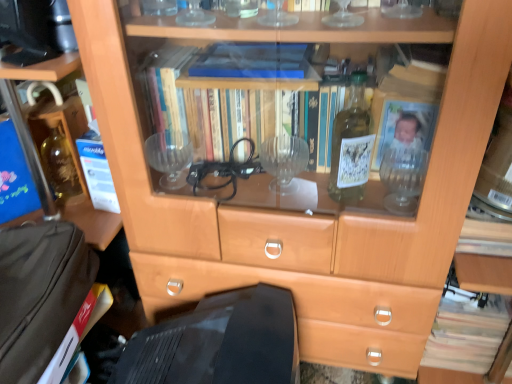
What do you see at coordinates (467, 332) in the screenshot? I see `light brown paper book at lower right` at bounding box center [467, 332].

What do you see at coordinates (219, 343) in the screenshot?
I see `black glossy computer monitor at lower center` at bounding box center [219, 343].

Locate an element on the screen. Image resolution: width=512 pixels, height=384 pixels. brown fabric suitcase at lower left is located at coordinates (40, 294).

Is white paper at left, which is the 1th paperback book in top-to-bottom order, oriented towards brown paper at left, placed as the first paperback book when sorted from bottom to top?

No, white paper at left, which is the 1th paperback book in top-to-bottom order, is not facing towards brown paper at left, placed as the first paperback book when sorted from bottom to top.

Considering the sizes of objects white paper at left, which is the 1th paperback book in top-to-bottom order, and brown paper at left, placed as the first paperback book when sorted from bottom to top, in the image provided, who is shorter, white paper at left, which is the 1th paperback book in top-to-bottom order, or brown paper at left, placed as the first paperback book when sorted from bottom to top,?

With less height is brown paper at left, placed as the first paperback book when sorted from bottom to top.

In the image, is white paper at left, which ranks as the second paperback book in bottom-to-top order, on the left side or the right side of brown paper at left, which is the second paperback book in top-to-bottom order?

Clearly, white paper at left, which ranks as the second paperback book in bottom-to-top order, is on the right of brown paper at left, which is the second paperback book in top-to-bottom order, in the image.

Is white paper at left, which ranks as the second paperback book in bottom-to-top order, bigger than brown paper at left, placed as the first paperback book when sorted from bottom to top?

Actually, white paper at left, which ranks as the second paperback book in bottom-to-top order, might be smaller than brown paper at left, placed as the first paperback book when sorted from bottom to top.

Does light brown paper book at lower right have a lesser width compared to white paper at left, which is the 1th paperback book in top-to-bottom order?

No.

From the picture: Does light brown paper book at lower right turn towards white paper at left, which is the 1th paperback book in top-to-bottom order?

No, light brown paper book at lower right does not turn towards white paper at left, which is the 1th paperback book in top-to-bottom order.

Considering the positions of points (487, 331) and (105, 185), is point (487, 331) farther from camera compared to point (105, 185)?

Yes, it is.

Which is more to the right, light brown paper book at lower right or white paper at left, which ranks as the second paperback book in bottom-to-top order?

Positioned to the right is light brown paper book at lower right.

In terms of height, does black glossy computer monitor at lower center look taller or shorter compared to brown fabric suitcase at lower left?

In the image, black glossy computer monitor at lower center appears to be taller than brown fabric suitcase at lower left.

Would you consider black glossy computer monitor at lower center to be distant from brown fabric suitcase at lower left?

No.

Who is smaller, black glossy computer monitor at lower center or brown fabric suitcase at lower left?

brown fabric suitcase at lower left is smaller.

Can you confirm if black glossy computer monitor at lower center is wider than brown fabric suitcase at lower left?

Indeed, black glossy computer monitor at lower center has a greater width compared to brown fabric suitcase at lower left.

Based on the photo, which of these two, brown fabric suitcase at lower left or light brown paper book at lower right, stands shorter?

brown fabric suitcase at lower left is shorter.

I want to click on book that appears behind the brown fabric suitcase at lower left, so click(x=467, y=332).

Considering the positions of objects brown fabric suitcase at lower left and light brown paper book at lower right in the image provided, who is more to the left, brown fabric suitcase at lower left or light brown paper book at lower right?

Positioned to the left is brown fabric suitcase at lower left.

Is brown paper at left, placed as the first paperback book when sorted from bottom to top, positioned behind brown fabric suitcase at lower left?

Yes, brown paper at left, placed as the first paperback book when sorted from bottom to top, is further from the viewer.

Visually, is brown paper at left, which is the second paperback book in top-to-bottom order, positioned to the left or to the right of brown fabric suitcase at lower left?

In the image, brown paper at left, which is the second paperback book in top-to-bottom order, appears on the right side of brown fabric suitcase at lower left.

Locate an element on the screen. The width and height of the screenshot is (512, 384). paperback book beneath the brown fabric suitcase at lower left (from a real-world perspective) is located at coordinates (78, 331).

How different are the orientations of brown paper at left, placed as the first paperback book when sorted from bottom to top, and brown fabric suitcase at lower left in degrees?

They differ by 6.89 degrees in their facing directions.

Which is in front, point (89, 138) or point (188, 334)?

The point (188, 334) is closer.

Considering the relative positions of white paper at left, which is the 1th paperback book in top-to-bottom order, and black glossy computer monitor at lower center in the image provided, is white paper at left, which is the 1th paperback book in top-to-bottom order, in front of black glossy computer monitor at lower center?

No, it is behind black glossy computer monitor at lower center.

Considering the sizes of white paper at left, which ranks as the second paperback book in bottom-to-top order, and black glossy computer monitor at lower center in the image, is white paper at left, which ranks as the second paperback book in bottom-to-top order, bigger or smaller than black glossy computer monitor at lower center?

Clearly, white paper at left, which ranks as the second paperback book in bottom-to-top order, is smaller in size than black glossy computer monitor at lower center.

How distant is white paper at left, which is the 1th paperback book in top-to-bottom order, from black glossy computer monitor at lower center?

white paper at left, which is the 1th paperback book in top-to-bottom order, is 36.39 centimeters from black glossy computer monitor at lower center.

Is brown paper at left, placed as the first paperback book when sorted from bottom to top, positioned far away from white paper at left, which ranks as the second paperback book in bottom-to-top order?

That's not correct — brown paper at left, placed as the first paperback book when sorted from bottom to top, is a little close to white paper at left, which ranks as the second paperback book in bottom-to-top order.

From a real-world perspective, which is physically below, brown paper at left, placed as the first paperback book when sorted from bottom to top, or white paper at left, which is the 1th paperback book in top-to-bottom order?

brown paper at left, placed as the first paperback book when sorted from bottom to top.

Which object is closer to the camera, brown paper at left, which is the second paperback book in top-to-bottom order, or white paper at left, which ranks as the second paperback book in bottom-to-top order?

brown paper at left, which is the second paperback book in top-to-bottom order, is closer to the camera.

Is brown paper at left, which is the second paperback book in top-to-bottom order, shorter than white paper at left, which ranks as the second paperback book in bottom-to-top order?

Correct, brown paper at left, which is the second paperback book in top-to-bottom order, is not as tall as white paper at left, which ranks as the second paperback book in bottom-to-top order.

This screenshot has width=512, height=384. Find the location of `paperback book that is below the white paper at left, which ranks as the second paperback book in bottom-to-top order (from the image's perspective)`. paperback book that is below the white paper at left, which ranks as the second paperback book in bottom-to-top order (from the image's perspective) is located at coordinates (78, 331).

Find the location of a particular element. This screenshot has height=384, width=512. book behind the white paper at left, which is the 1th paperback book in top-to-bottom order is located at coordinates (467, 332).

Based on their spatial positions, is black glossy computer monitor at lower center or brown paper at left, which is the second paperback book in top-to-bottom order, closer to light brown paper book at lower right?

Based on the image, black glossy computer monitor at lower center appears to be nearer to light brown paper book at lower right.

Considering their positions, is white paper at left, which is the 1th paperback book in top-to-bottom order, positioned further to brown paper at left, placed as the first paperback book when sorted from bottom to top, than black glossy computer monitor at lower center?

Based on the image, white paper at left, which is the 1th paperback book in top-to-bottom order, appears to be further to brown paper at left, placed as the first paperback book when sorted from bottom to top.

When comparing their distances from white paper at left, which ranks as the second paperback book in bottom-to-top order, does black glossy computer monitor at lower center or light brown paper book at lower right seem further?

The object further to white paper at left, which ranks as the second paperback book in bottom-to-top order, is light brown paper book at lower right.

Estimate the real-world distances between objects in this image. Which object is further from black glossy computer monitor at lower center, light brown paper book at lower right or brown fabric suitcase at lower left?

light brown paper book at lower right lies further to black glossy computer monitor at lower center than the other object.

Considering their positions, is brown fabric suitcase at lower left positioned further to brown paper at left, which is the second paperback book in top-to-bottom order, than light brown paper book at lower right?

light brown paper book at lower right is positioned further to the anchor brown paper at left, which is the second paperback book in top-to-bottom order.

Looking at this image, when comparing their distances from light brown paper book at lower right, does black glossy computer monitor at lower center or white paper at left, which ranks as the second paperback book in bottom-to-top order, seem further?

white paper at left, which ranks as the second paperback book in bottom-to-top order, lies further to light brown paper book at lower right than the other object.

Based on their spatial positions, is white paper at left, which ranks as the second paperback book in bottom-to-top order, or light brown paper book at lower right closer to brown paper at left, which is the second paperback book in top-to-bottom order?

Among the two, white paper at left, which ranks as the second paperback book in bottom-to-top order, is located nearer to brown paper at left, which is the second paperback book in top-to-bottom order.

Based on their spatial positions, is brown paper at left, which is the second paperback book in top-to-bottom order, or white paper at left, which is the 1th paperback book in top-to-bottom order, closer to light brown paper book at lower right?

Based on the image, brown paper at left, which is the second paperback book in top-to-bottom order, appears to be nearer to light brown paper book at lower right.

Locate an element on the screen. computer monitor between white paper at left, which ranks as the second paperback book in bottom-to-top order, and light brown paper book at lower right is located at coordinates (219, 343).

The height and width of the screenshot is (384, 512). I want to click on computer monitor between brown paper at left, which is the second paperback book in top-to-bottom order, and light brown paper book at lower right, in the horizontal direction, so click(x=219, y=343).

Locate an element on the screen. Image resolution: width=512 pixels, height=384 pixels. computer monitor between brown fabric suitcase at lower left and light brown paper book at lower right is located at coordinates (219, 343).

Locate an element on the screen. This screenshot has width=512, height=384. luggage between white paper at left, which ranks as the second paperback book in bottom-to-top order, and black glossy computer monitor at lower center vertically is located at coordinates (40, 294).